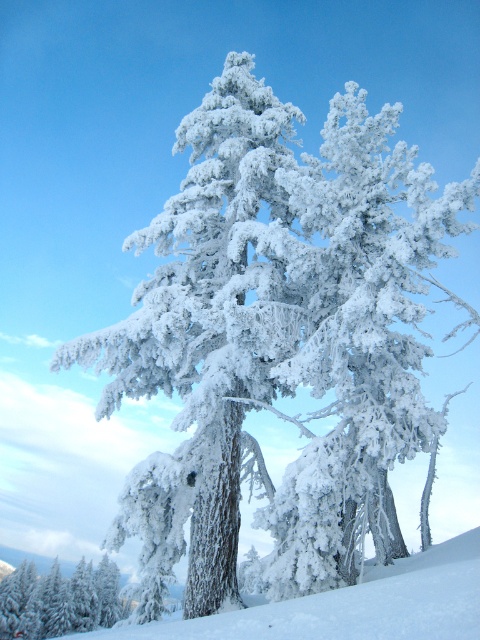
Question: Among these objects, which one is nearest to the camera?

Choices:
 (A) white snow at center
 (B) white frosty tree at lower left

Answer: (A)

Question: Can you confirm if white snow at center is smaller than white frosty tree at lower left?

Choices:
 (A) no
 (B) yes

Answer: (A)

Question: From the image, what is the correct spatial relationship of white snow at center in relation to white frosty tree at lower left?

Choices:
 (A) below
 (B) above

Answer: (B)

Question: Which point is closer to the camera taking this photo?

Choices:
 (A) (475, 616)
 (B) (94, 600)

Answer: (A)

Question: Which object is farther from the camera taking this photo?

Choices:
 (A) white frosty tree at lower left
 (B) white snow at center

Answer: (A)

Question: Considering the relative positions of white snow at center and white frosty tree at lower left in the image provided, where is white snow at center located with respect to white frosty tree at lower left?

Choices:
 (A) below
 (B) above

Answer: (B)